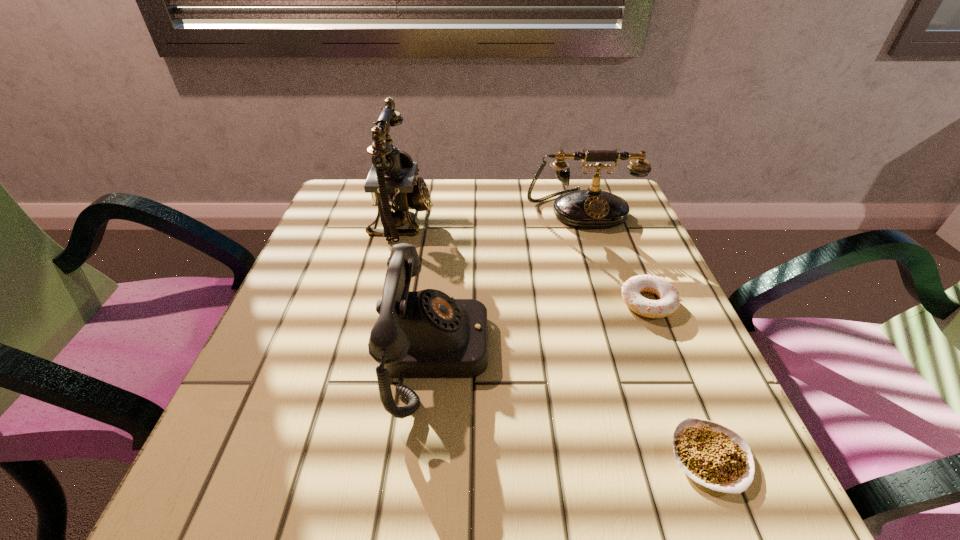
What are the coordinates of `the tallest object` in the screenshot? It's located at (392, 182).

Locate an element on the screen. This screenshot has height=540, width=960. the rightmost telephone is located at coordinates (593, 208).

At what (x,y) coordinates should I click in order to perform the action: click on the nearest telephone. Please return your answer as a coordinate pair (x, y). Looking at the image, I should click on (420, 334).

I want to click on doughnut, so click(669, 301).

The height and width of the screenshot is (540, 960). What are the coordinates of `legume` in the screenshot? It's located at (712, 455).

Find the location of a particular element. free space located 0.090m on the rotary dial of the tallest telephone is located at coordinates (470, 220).

The width and height of the screenshot is (960, 540). I want to click on free location located on the dial of the rightmost telephone, so click(x=609, y=295).

What are the coordinates of `free space located 0.190m on the dial of the nearest telephone` in the screenshot? It's located at (599, 353).

The height and width of the screenshot is (540, 960). What are the coordinates of `blank space located on the back of the doughnut` in the screenshot? It's located at (634, 267).

Identify the location of vacant point located 0.170m on the left of the legume. (549, 457).